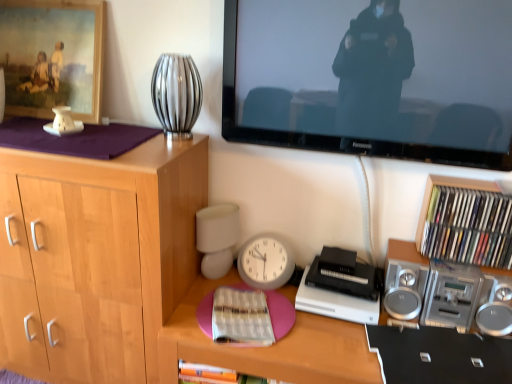
Locate an element on the screen. This screenshot has height=384, width=512. vacant space to the right of white paper book at center, placed as the second book when sorted from right to left is located at coordinates (314, 340).